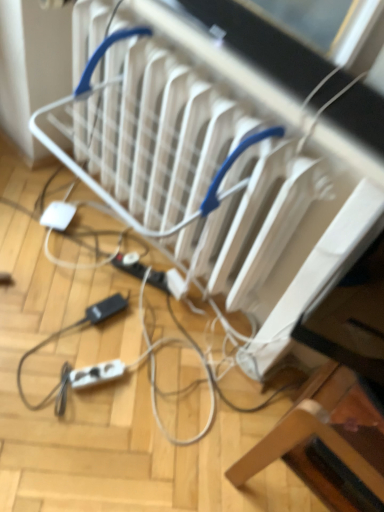
Question: Is there a large distance between white plastic extension cord at lower left, which is counted as the 2th extension cord, starting from the top, and white plastic radiator at center?

Choices:
 (A) yes
 (B) no

Answer: (B)

Question: From the image's perspective, is white plastic extension cord at lower left, placed as the 1th extension cord when sorted from front to back, above white plastic radiator at center?

Choices:
 (A) yes
 (B) no

Answer: (B)

Question: Does white plastic extension cord at lower left, the second extension cord when ordered from back to front, have a greater height compared to white plastic radiator at center?

Choices:
 (A) yes
 (B) no

Answer: (B)

Question: Considering the relative sizes of white plastic extension cord at lower left, which ranks as the 1th extension cord in bottom-to-top order, and white plastic radiator at center in the image provided, is white plastic extension cord at lower left, which ranks as the 1th extension cord in bottom-to-top order, thinner than white plastic radiator at center?

Choices:
 (A) yes
 (B) no

Answer: (A)

Question: Is white plastic extension cord at lower left, the second extension cord when ordered from back to front, positioned with its back to white plastic radiator at center?

Choices:
 (A) yes
 (B) no

Answer: (B)

Question: Considering the positions of point (317, 398) and point (140, 274), is point (317, 398) closer or farther from the camera than point (140, 274)?

Choices:
 (A) farther
 (B) closer

Answer: (B)

Question: Is wooden chair at lower right inside the boundaries of white plastic extension cord at lower center, the 1th extension cord when ordered from top to bottom, or outside?

Choices:
 (A) outside
 (B) inside

Answer: (A)

Question: From a real-world perspective, is wooden chair at lower right positioned above or below white plastic extension cord at lower center, which is counted as the second extension cord, starting from the bottom?

Choices:
 (A) above
 (B) below

Answer: (A)

Question: Considering the positions of wooden chair at lower right and white plastic extension cord at lower center, the 1th extension cord when ordered from top to bottom, in the image, is wooden chair at lower right wider or thinner than white plastic extension cord at lower center, the 1th extension cord when ordered from top to bottom,?

Choices:
 (A) thin
 (B) wide

Answer: (B)

Question: Choose the correct answer: Is white plastic radiator at center inside white plastic extension cord at lower left, placed as the 1th extension cord when sorted from front to back, or outside it?

Choices:
 (A) inside
 (B) outside

Answer: (B)

Question: In the image, is white plastic radiator at center positioned in front of or behind white plastic extension cord at lower left, which is counted as the 2th extension cord, starting from the top?

Choices:
 (A) behind
 (B) front

Answer: (B)

Question: Is white plastic radiator at center to the left or to the right of white plastic extension cord at lower left, which is counted as the 2th extension cord, starting from the top, in the image?

Choices:
 (A) right
 (B) left

Answer: (A)

Question: Is point (168, 86) closer or farther from the camera than point (76, 381)?

Choices:
 (A) farther
 (B) closer

Answer: (B)

Question: Is white plastic radiator at center in front of or behind white plastic extension cord at lower center, the first extension cord in the back-to-front sequence, in the image?

Choices:
 (A) behind
 (B) front

Answer: (B)

Question: Looking at their shapes, would you say white plastic radiator at center is wider or thinner than white plastic extension cord at lower center, the 1th extension cord when ordered from top to bottom?

Choices:
 (A) wide
 (B) thin

Answer: (A)